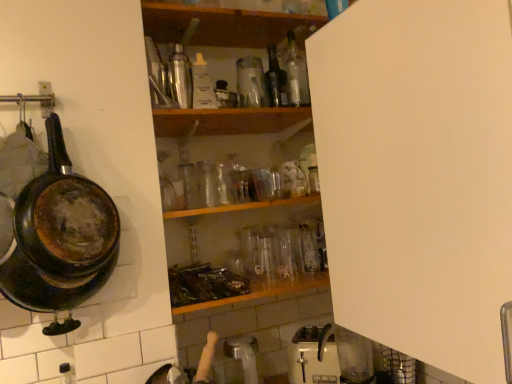
Question: Can you confirm if translucent glass bottle at center, arranged as the second bottle when viewed from the right, is thinner than translucent glass bottle at lower left, arranged as the seventh bottle when viewed from the right?

Choices:
 (A) yes
 (B) no

Answer: (B)

Question: Is translucent glass bottle at center, which is the second bottle in top-to-bottom order, not inside translucent glass bottle at lower left, the first bottle in the bottom-to-top sequence?

Choices:
 (A) no
 (B) yes

Answer: (B)

Question: Does translucent glass bottle at center, the sixth bottle when ordered from bottom to top, lie behind translucent glass bottle at lower left, arranged as the seventh bottle when viewed from the right?

Choices:
 (A) no
 (B) yes

Answer: (B)

Question: From a real-world perspective, is translucent glass bottle at center, arranged as the second bottle when viewed from the right, located higher than translucent glass bottle at lower left, the 1th bottle in the left-to-right sequence?

Choices:
 (A) yes
 (B) no

Answer: (A)

Question: Could you tell me if translucent glass bottle at center, placed as the 6th bottle when sorted from left to right, is turned towards translucent glass bottle at lower left, arranged as the seventh bottle when viewed from the right?

Choices:
 (A) no
 (B) yes

Answer: (A)

Question: From the image's perspective, is translucent glass bottle at center, arranged as the second bottle when viewed from the right, on top of translucent glass bottle at lower left, the 1th bottle in the left-to-right sequence?

Choices:
 (A) no
 (B) yes

Answer: (B)

Question: Is rusty cast iron frying pan at left at the right side of white matte cabinet at upper right?

Choices:
 (A) yes
 (B) no

Answer: (B)

Question: From a real-world perspective, does rusty cast iron frying pan at left sit lower than white matte cabinet at upper right?

Choices:
 (A) yes
 (B) no

Answer: (B)

Question: Is rusty cast iron frying pan at left looking in the opposite direction of white matte cabinet at upper right?

Choices:
 (A) no
 (B) yes

Answer: (A)

Question: Considering the relative positions of rusty cast iron frying pan at left and white matte cabinet at upper right in the image provided, is rusty cast iron frying pan at left behind white matte cabinet at upper right?

Choices:
 (A) no
 (B) yes

Answer: (B)

Question: Is rusty cast iron frying pan at left bigger than white matte cabinet at upper right?

Choices:
 (A) no
 (B) yes

Answer: (A)

Question: From the image's perspective, is rusty cast iron frying pan at left located beneath white matte cabinet at upper right?

Choices:
 (A) no
 (B) yes

Answer: (B)

Question: Considering the relative sizes of transparent glass bottle at center, marked as the 2th bottle in a bottom-to-top arrangement, and white matte cabinet at upper right in the image provided, is transparent glass bottle at center, marked as the 2th bottle in a bottom-to-top arrangement, bigger than white matte cabinet at upper right?

Choices:
 (A) yes
 (B) no

Answer: (B)